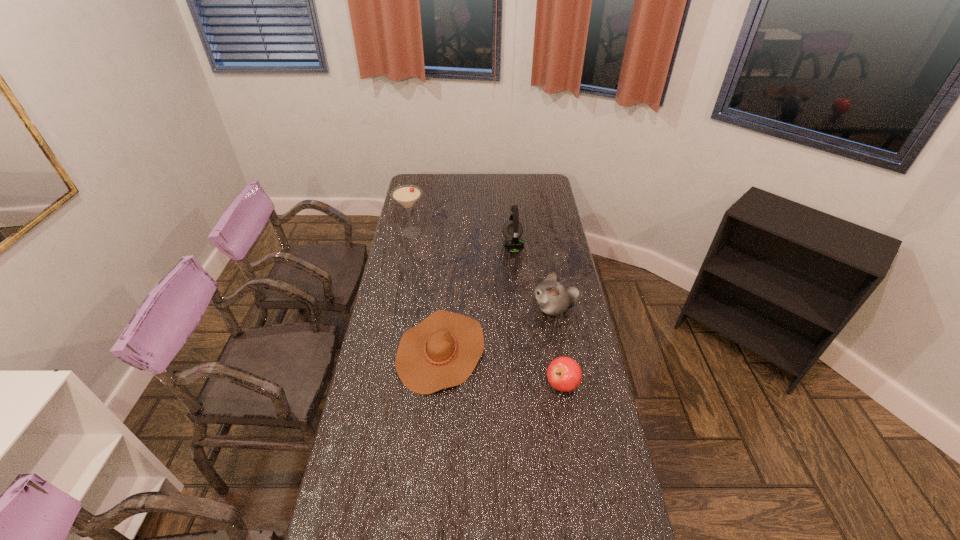
In the image, there is a desktop. What are the coordinates of `free space at the right edge` in the screenshot? It's located at (562, 432).

Find the location of a particular element. The width and height of the screenshot is (960, 540). free spot at the far left corner of the desktop is located at coordinates (416, 180).

Identify the location of vacant region between the shortest object and the hamster. This screenshot has width=960, height=540. (497, 329).

At what (x,y) coordinates should I click in order to perform the action: click on vacant space that's between the third shortest object and the martini. Please return your answer as a coordinate pair (x, y). Looking at the image, I should click on (483, 271).

Find the location of `free spot between the apple and the hamster`. free spot between the apple and the hamster is located at coordinates (558, 347).

This screenshot has height=540, width=960. I want to click on unoccupied area between the cowboy hat and the hamster, so [x=497, y=329].

Find the location of a particular element. This screenshot has height=540, width=960. vacant area between the headset and the cowboy hat is located at coordinates (477, 298).

Locate an element on the screen. The image size is (960, 540). empty space that is in between the apple and the headset is located at coordinates (538, 315).

Locate an element on the screen. The height and width of the screenshot is (540, 960). free area in between the apple and the third shortest object is located at coordinates (558, 347).

This screenshot has height=540, width=960. I want to click on unoccupied position between the shortest object and the second shortest object, so coord(501,368).